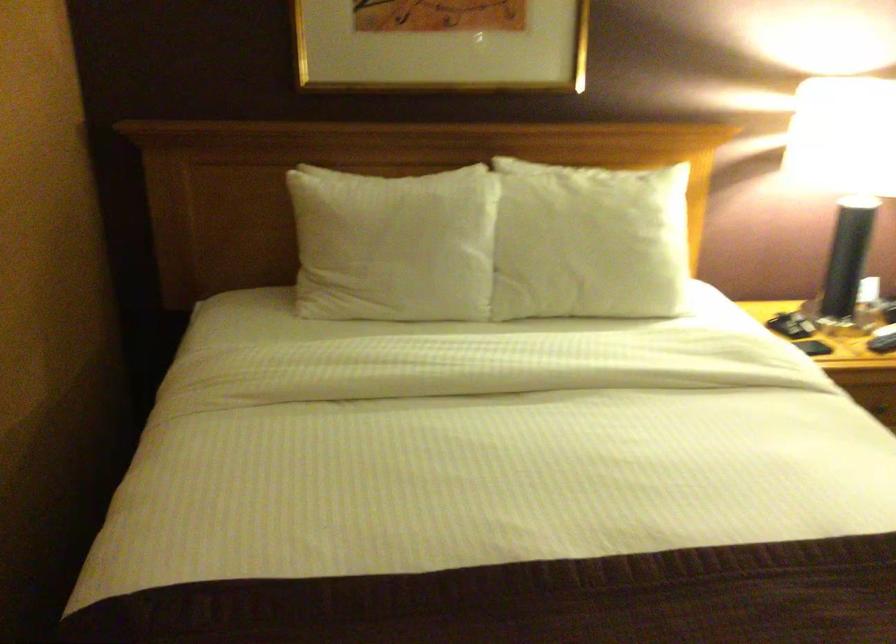
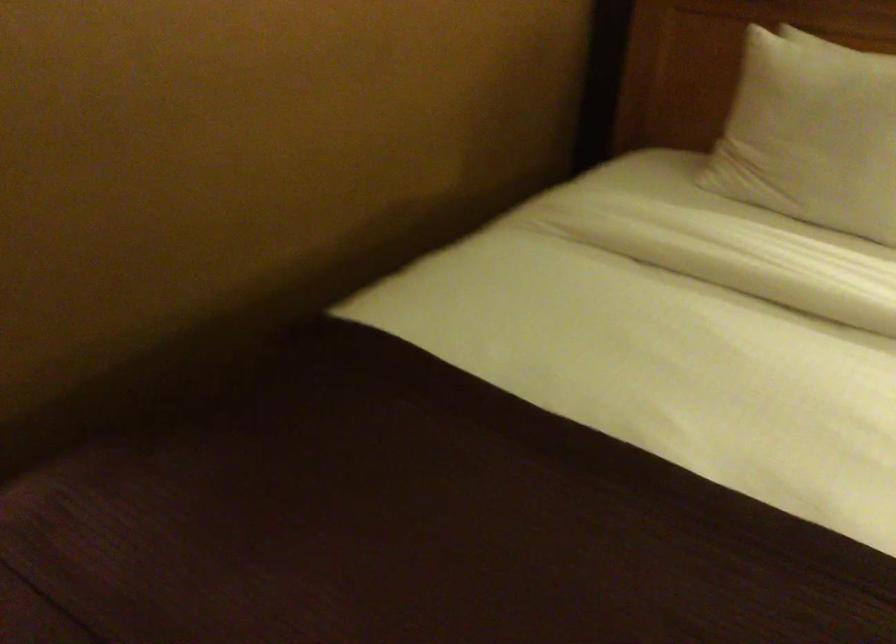
Question: The first image is from the beginning of the video and the second image is from the end. How did the camera likely rotate when shooting the video?

Choices:
 (A) Left
 (B) Right
 (C) Up
 (D) Down

Answer: (A)